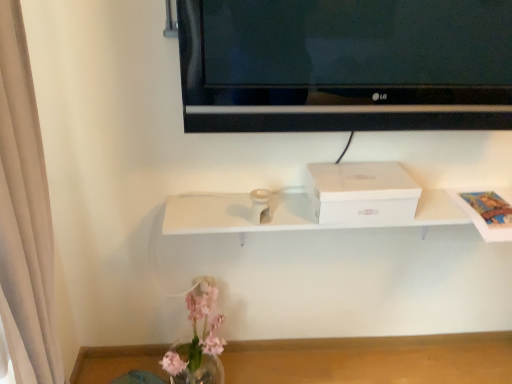
You are a GUI agent. You are given a task and a screenshot of the screen. Output one action in this format:
    pyautogui.click(x=<x>, y=<y>)
    Task: Click on the blank area beneath black glossy tv at upper center (from a real-world perspective)
    Image resolution: width=512 pixels, height=384 pixels.
    Given the screenshot: What is the action you would take?
    pyautogui.click(x=356, y=101)